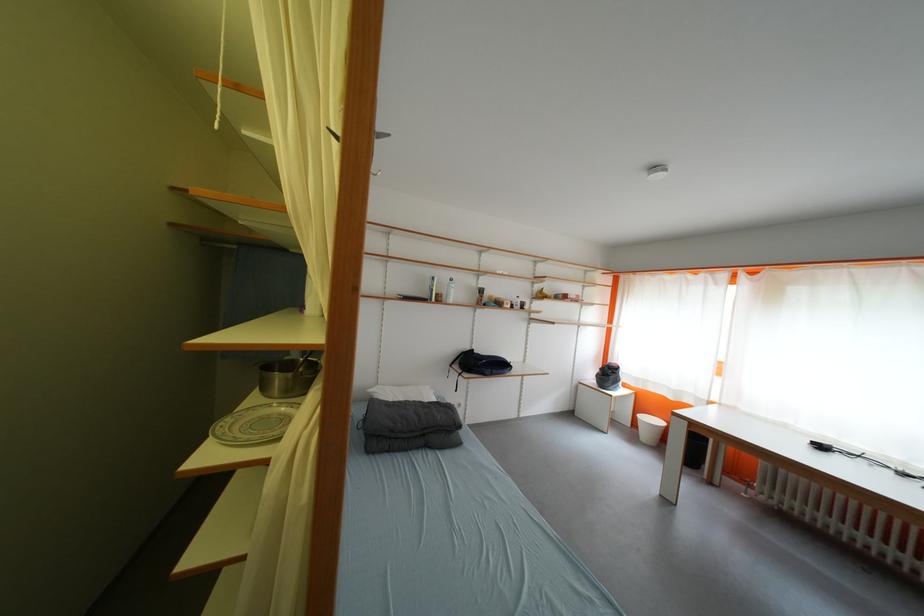
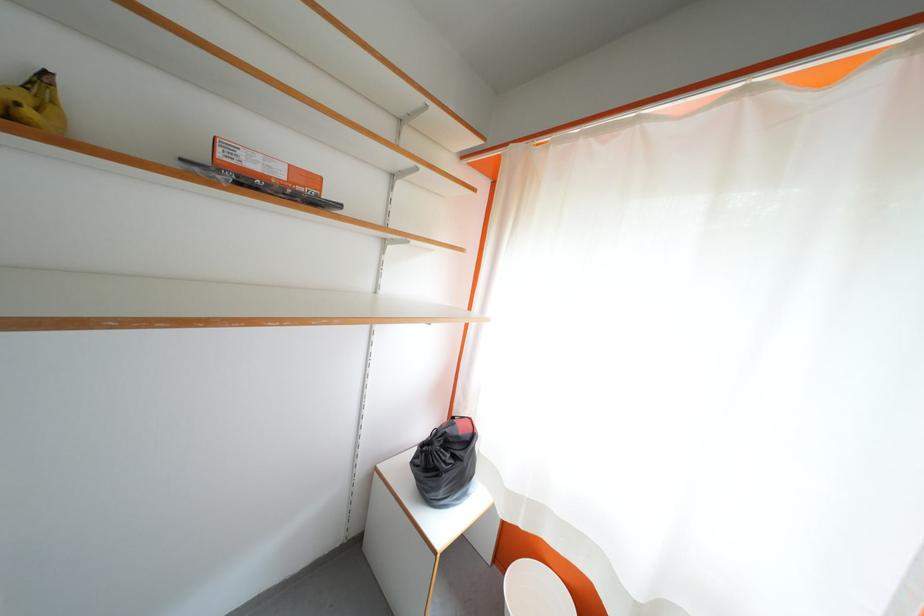
The point at (x=617, y=378) is marked in the first image. Where is the corresponding point in the second image?

(455, 460)